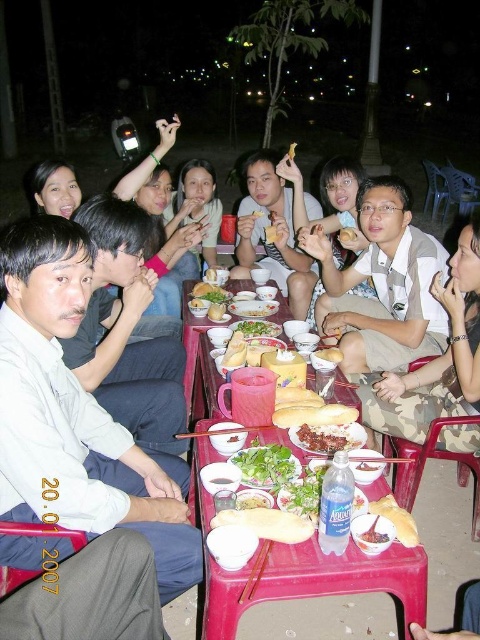
Question: Which point appears closest to the camera in this image?

Choices:
 (A) (271, 257)
 (B) (46, 200)
 (C) (127, 193)
 (D) (336, 448)

Answer: (D)

Question: Is smooth plastic table at center thinner than smooth yellow bread at center?

Choices:
 (A) yes
 (B) no

Answer: (B)

Question: Which object is the closest to the matte brown shirt at center?

Choices:
 (A) matte beige shirt at center
 (B) soft bread at lower center
 (C) matte black phone at upper center

Answer: (C)

Question: Among these points, which one is farthest from the camera?

Choices:
 (A) (376, 522)
 (B) (381, 513)

Answer: (B)

Question: Does smooth yellow bread at center appear on the right side of smooth white rice at center?

Choices:
 (A) yes
 (B) no

Answer: (A)

Question: Does green leafy salad at center have a lesser width compared to green leafy vegetable at center?

Choices:
 (A) yes
 (B) no

Answer: (A)